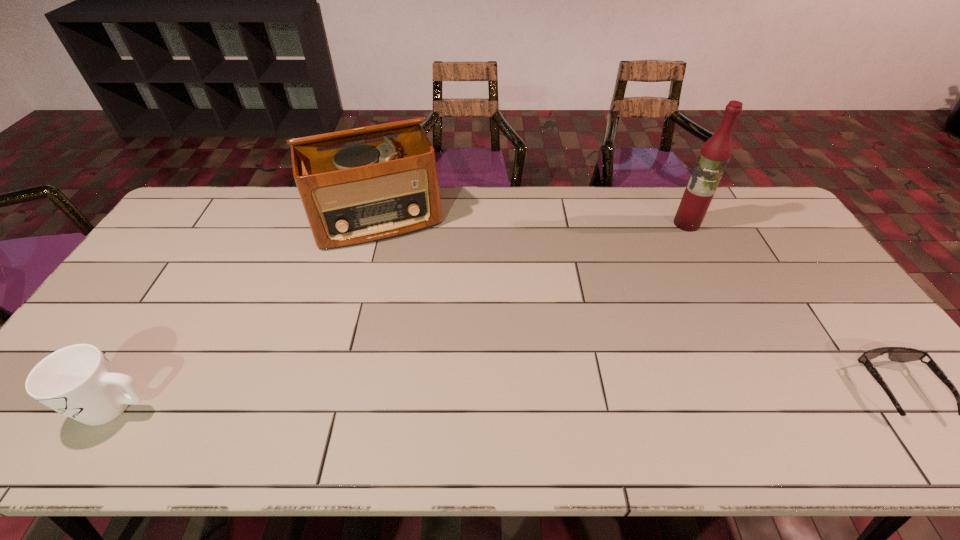
The image size is (960, 540). In order to click on mug in this screenshot , I will do `click(78, 381)`.

Find the location of `the second shortest object`. the second shortest object is located at coordinates (78, 381).

This screenshot has height=540, width=960. I want to click on the third object from right to left, so click(x=371, y=191).

This screenshot has height=540, width=960. Identify the location of liquor. (715, 153).

At what (x,y) coordinates should I click in order to perform the action: click on free space located 0.050m on the side of the mug with the handle. Please return your answer as a coordinate pair (x, y). The height and width of the screenshot is (540, 960). Looking at the image, I should click on (58, 407).

Where is `vacant position located on the front panel of the second object from left to right`? Image resolution: width=960 pixels, height=540 pixels. vacant position located on the front panel of the second object from left to right is located at coordinates (417, 325).

The image size is (960, 540). Find the location of `free space located 0.370m on the front panel of the second object from left to right`. free space located 0.370m on the front panel of the second object from left to right is located at coordinates (421, 339).

Locate an element on the screen. The width and height of the screenshot is (960, 540). vacant space located 0.240m on the front panel of the second object from left to right is located at coordinates (410, 303).

This screenshot has height=540, width=960. Find the location of `vacant space located on the label of the liquor`. vacant space located on the label of the liquor is located at coordinates (637, 302).

I want to click on blank space located 0.170m on the label of the liquor, so click(664, 259).